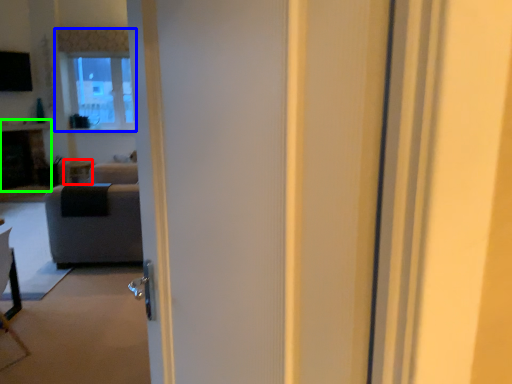
Question: Which is nearer to the side table (highlighted by a red box)? window (highlighted by a blue box) or fireplace (highlighted by a green box).

Choices:
 (A) window
 (B) fireplace

Answer: (B)